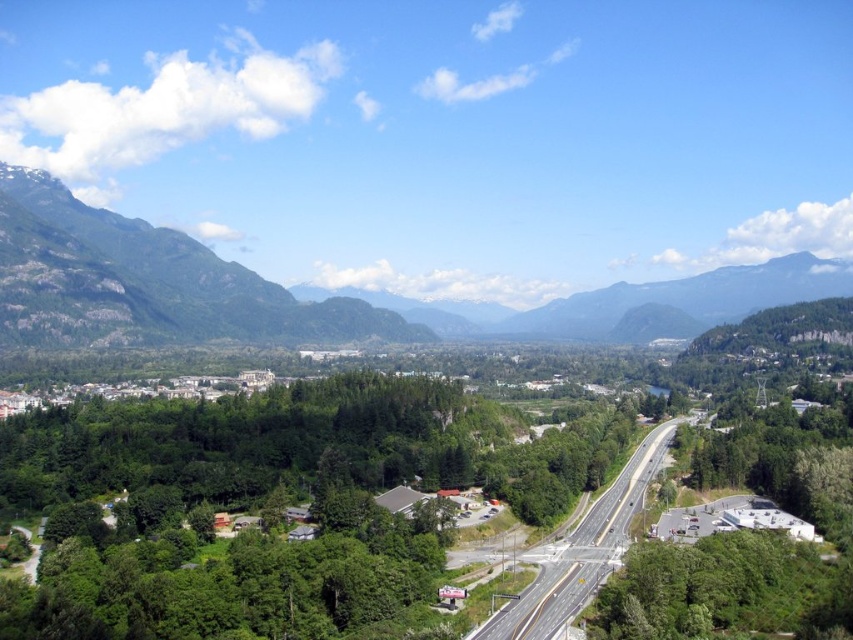
You are driving along the asphalt road at center and want to take a photo of the green rock mountain at upper left. Is the mountain visible from your current position on the road?

The green rock mountain at upper left is positioned over asphalt road at center, so yes, the mountain is visible from your current position on the road.

You are a drone operator flying a drone that needs to capture a photo of both the point at coordinates point (102, 211) and point (628, 556). To ensure both points are in focus, which point should you set as the focus point if you can only focus on one? Please explain your reasoning based on their positions relative to the camera.

You should set the focus point at point (628, 556) because it is closer to the camera than point (102, 211). Since the point further away is already out of focus, focusing on the closer one might not capture both in focus. Alternatively, focusing on the point further away might not work either. Wait, the description says point (102, 211) is further to the camera than point (628, 556). Wait, the Objects Description says point (102, 211) is further to the camera than point (628, 556). So point 0.3

You are a hiker standing at the starting point of the trail. You want to reach the green rock mountain at upper left. According to the map, the trail is 500 meters long. Will you be able to reach the mountain within the trail length?

The green rock mountain at upper left is 511.57 meters away from the viewer. Since the trail is only 500 meters long, you will not be able to reach the mountain within the trail length.